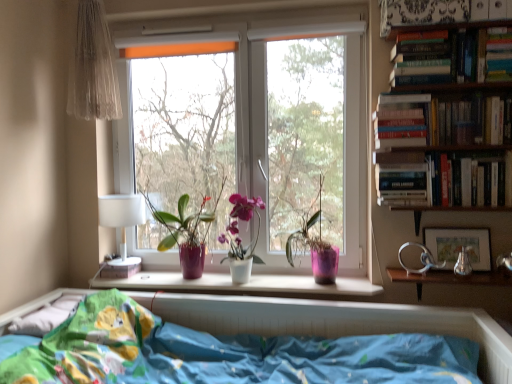
Find the location of a particular element. The height and width of the screenshot is (384, 512). empty space that is ontop of transparent plastic window at center (from a real-world perspective) is located at coordinates coord(304,27).